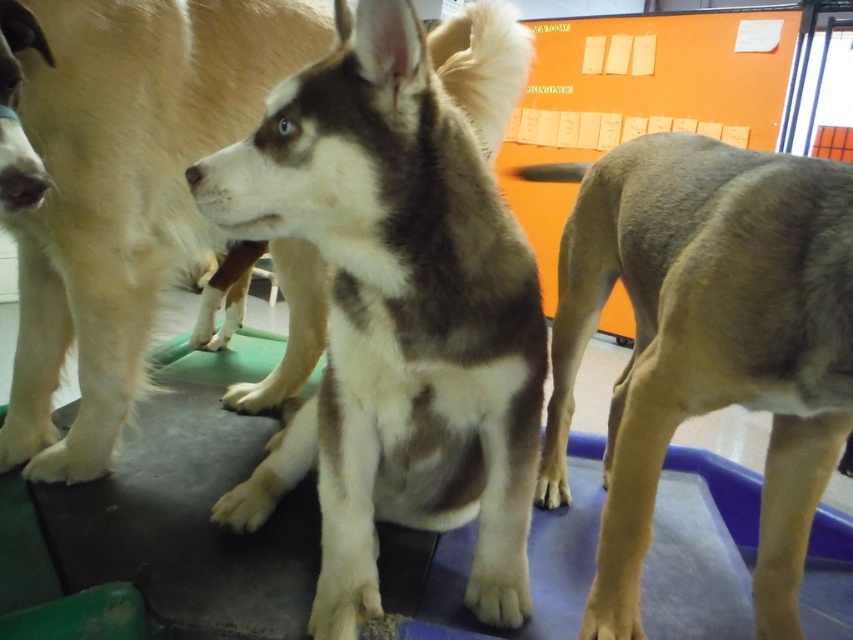
You are a photographer positioned at the back of the room. You want to take a photo of the brown and white fur at center and the brown fur dog at right. Which dog will appear larger in your photo?

The brown and white fur at center will appear larger in the photo because it is closer to the viewer than the brown fur dog at right.

You are a photographer trying to capture the perfect shot of the dogs in the scene. You notice a specific point marked at coordinates point (393, 317). What is the significance of this point in relation to the dogs?

The point (393, 317) marks the location of brown and white fur at center, which is the Siberian Husky with blue eyes sitting on the dark mat. This point is significant as it indicates the central subject of the image.